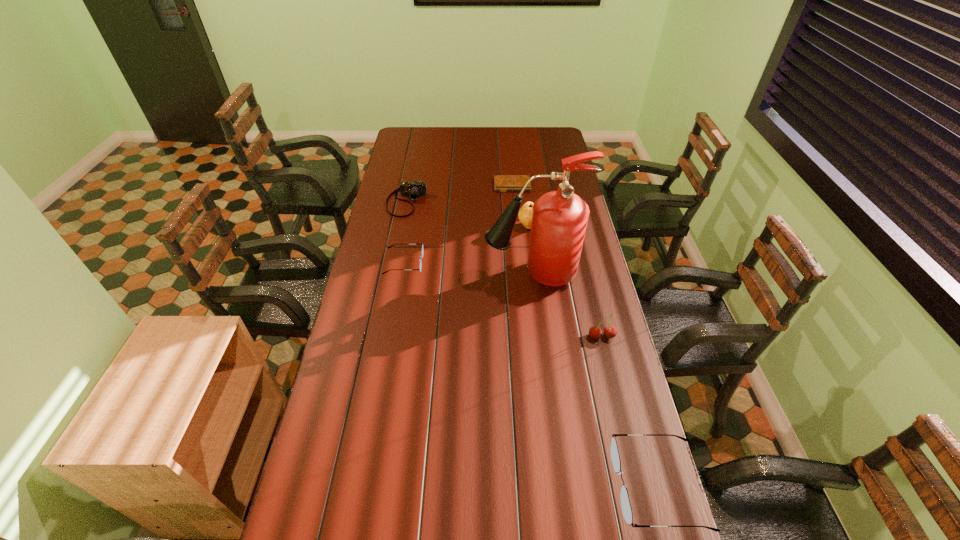
Where is `free space located on the lenses of the nearer spectacles`? free space located on the lenses of the nearer spectacles is located at coordinates (538, 485).

This screenshot has height=540, width=960. What are the coordinates of `vacant area situated 0.390m on the lenses of the nearer spectacles` in the screenshot? It's located at (x=464, y=485).

The height and width of the screenshot is (540, 960). Identify the location of vacant region located on the lenses of the nearer spectacles. (511, 485).

The image size is (960, 540). What are the coordinates of `vacant space located 0.170m on the right of the pear` in the screenshot? It's located at (579, 226).

Where is `vacant space situated on the front-facing side of the camera`? The height and width of the screenshot is (540, 960). vacant space situated on the front-facing side of the camera is located at coordinates (393, 273).

The image size is (960, 540). What are the coordinates of `vacant position located on the spine side of the shortest object` in the screenshot? It's located at (517, 244).

Identify the location of vacant space located with the nozzle aimed from the fire extinguisher. This screenshot has width=960, height=540. (440, 274).

This screenshot has height=540, width=960. Find the location of `blank area located 0.140m with the nozzle aimed from the fire extinguisher`. blank area located 0.140m with the nozzle aimed from the fire extinguisher is located at coordinates (447, 274).

Where is `vacant space located with the nozzle aimed from the fire extinguisher`? The height and width of the screenshot is (540, 960). vacant space located with the nozzle aimed from the fire extinguisher is located at coordinates (437, 274).

Find the location of a particular element. vacant region located 0.300m on the surface of the second nearest object is located at coordinates (624, 428).